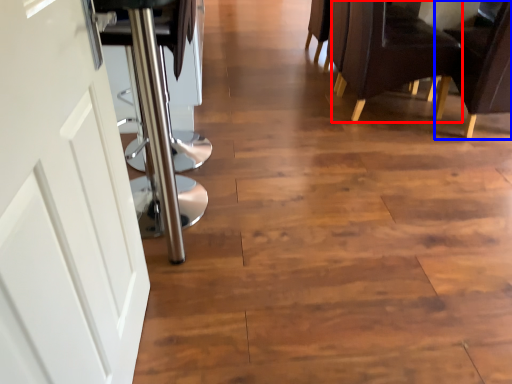
Question: Which object appears farthest to the camera in this image, chair (highlighted by a red box) or chair (highlighted by a blue box)?

Choices:
 (A) chair
 (B) chair

Answer: (A)